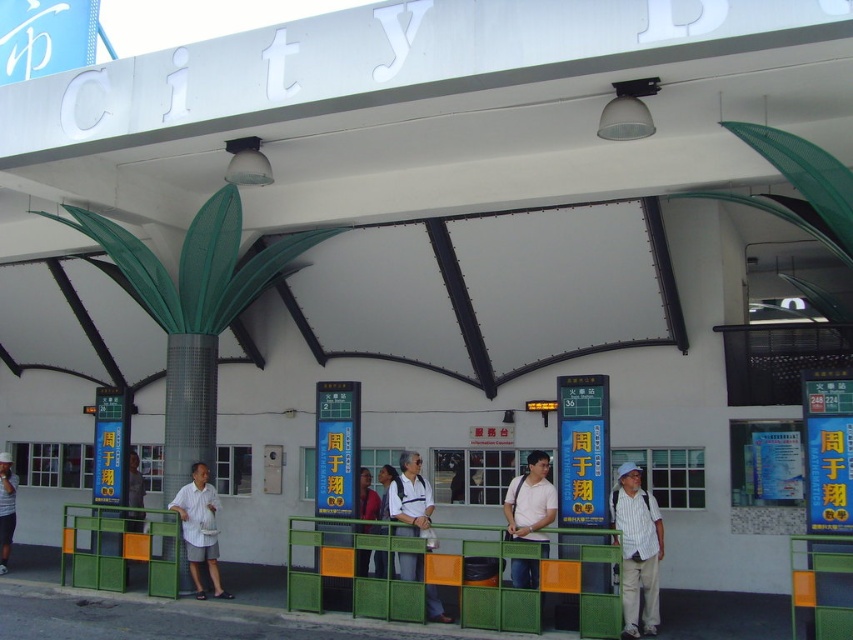
You are observing two people at the entrance of the building. They are both wearing white shirts. One is wearing a white fabric shirt at center and the other a white cotton shirt at center. Which person is shorter?

The white fabric shirt at center is not as tall as the white cotton shirt at center, so the person wearing the white fabric shirt at center is shorter.